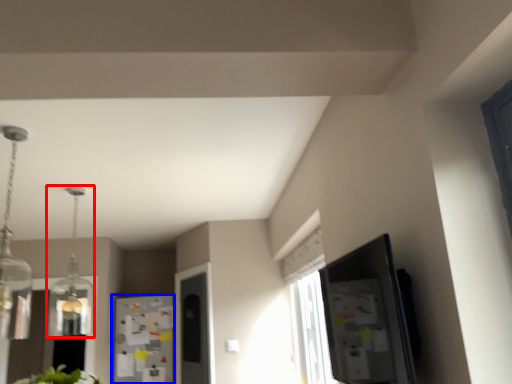
Question: Among these objects, which one is farthest to the camera, light fixture (highlighted by a red box) or fridge (highlighted by a blue box)?

Choices:
 (A) light fixture
 (B) fridge

Answer: (B)